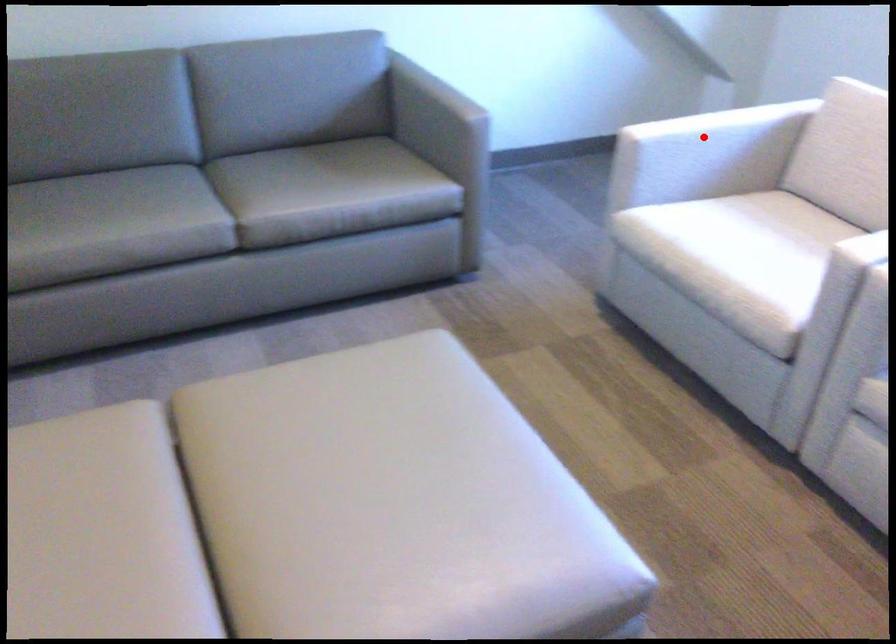
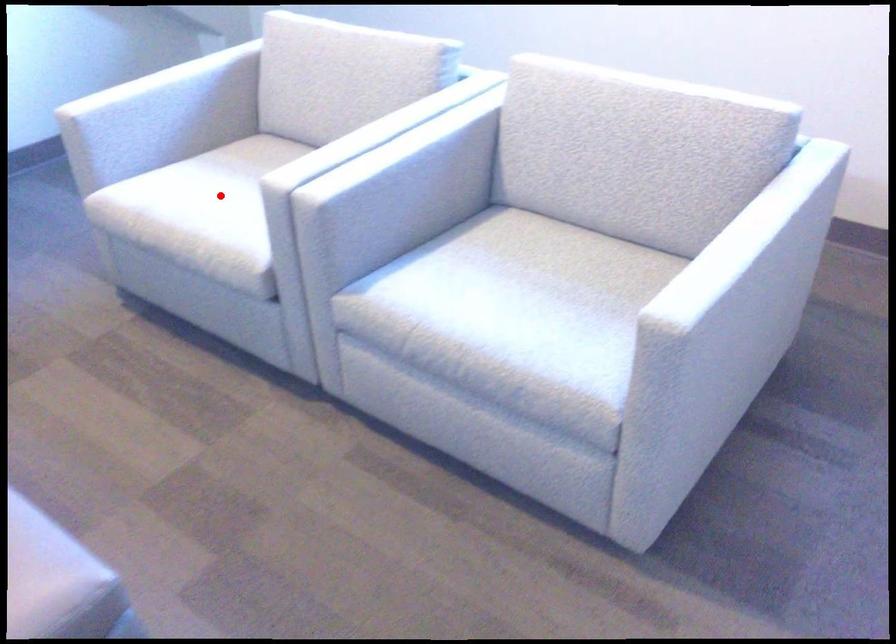
I am providing you with two images of the same scene from different viewpoints. A red point is marked on the first image and another point is marked on the second image. Are the points marked in image1 and image2 representing the same 3D position?

No